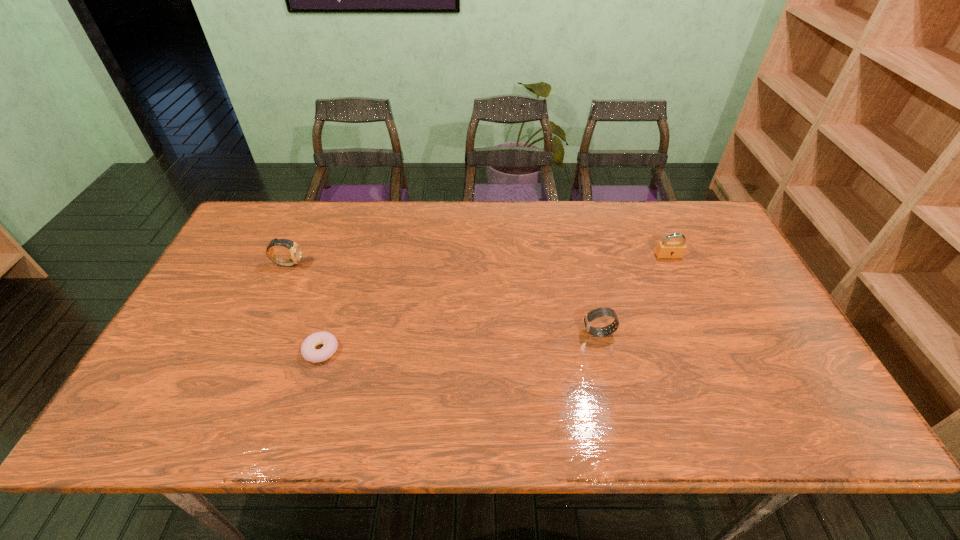
Select which object appears as the third closest to the padlock. Please provide its 2D coordinates. Your answer should be formatted as a tuple, i.e. [(x, y)], where the tuple contains the x and y coordinates of a point satisfying the conditions above.

[(295, 249)]

I want to click on free point that satisfies the following two spatial constraints: 1. to unlock the rightmost object from the front; 2. on the face of the right watch, so click(x=703, y=333).

Locate an element on the screen. This screenshot has width=960, height=540. free location that satisfies the following two spatial constraints: 1. to unlock the padlock from the front; 2. on the face of the leftmost object is located at coordinates (672, 264).

Find the location of a particular element. The image size is (960, 540). vacant region that satisfies the following two spatial constraints: 1. to unlock the rightmost object from the front; 2. on the face of the nearer watch is located at coordinates (703, 333).

The height and width of the screenshot is (540, 960). I want to click on free space in the image that satisfies the following two spatial constraints: 1. to unlock the rightmost object from the front; 2. on the face of the left watch, so click(672, 264).

Identify the location of free region that satisfies the following two spatial constraints: 1. on the face of the right watch; 2. on the front side of the shortest object. The width and height of the screenshot is (960, 540). (603, 350).

Identify the location of blank space that satisfies the following two spatial constraints: 1. on the face of the doughnut; 2. on the left side of the farther watch. (249, 350).